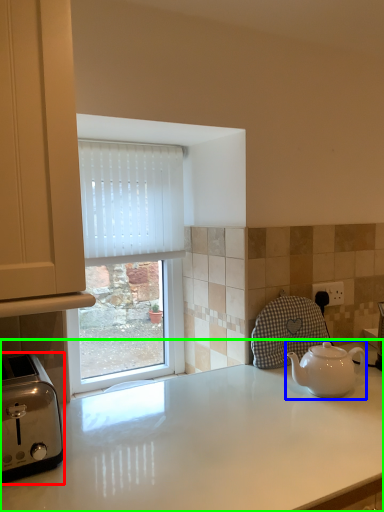
Question: Which object is the farthest from toaster (highlighted by a red box)? Choose among these: kettle (highlighted by a blue box) or countertop (highlighted by a green box).

Choices:
 (A) kettle
 (B) countertop

Answer: (A)